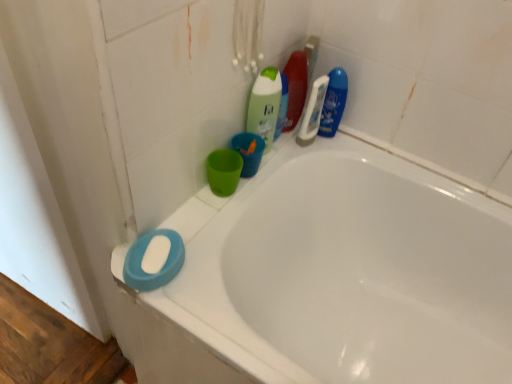
Identify the location of free space in front of blue glossy bottle at upper right, the 4th cleaning product from the left. (313, 155).